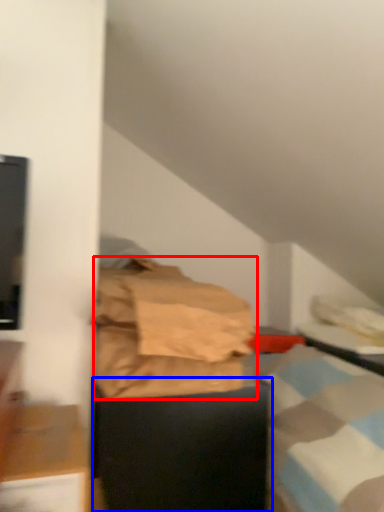
Question: Which of the following is the closest to the observer, material (highlighted by a red box) or furniture (highlighted by a blue box)?

Choices:
 (A) material
 (B) furniture

Answer: (A)